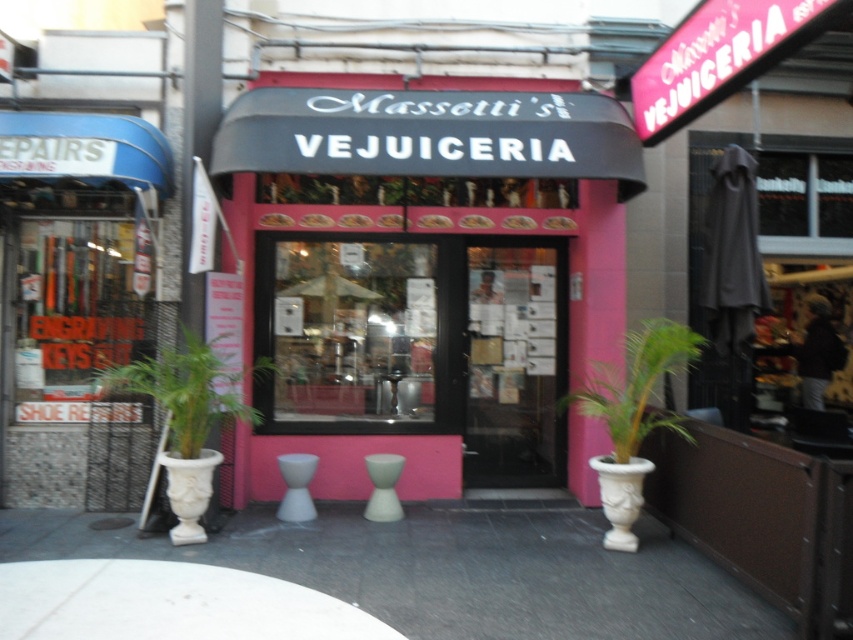
Between green leafy plant at lower right and white matte stool at center, which one has less height?

white matte stool at center is shorter.

Is green leafy plant at lower right positioned before white matte stool at center?

That is True.

Is point (566, 404) closer to camera compared to point (287, 456)?

No, (566, 404) is further to viewer.

Identify the location of green leafy plant at lower right. (637, 385).

Who is more forward, (x=254, y=417) or (x=372, y=502)?

Point (x=372, y=502) is in front.

Does green leafy plant at lower left have a greater width compared to white glossy stool at center?

Correct, the width of green leafy plant at lower left exceeds that of white glossy stool at center.

Is point (143, 378) positioned before point (397, 480)?

Yes, it is.

Locate an element on the screen. The width and height of the screenshot is (853, 640). green leafy plant at lower left is located at coordinates (184, 390).

Is point (647, 419) closer to viewer compared to point (387, 506)?

Yes, it is in front of point (387, 506).

This screenshot has height=640, width=853. I want to click on green leafy plant at lower right, so click(x=637, y=385).

Locate an element on the screen. Image resolution: width=853 pixels, height=640 pixels. green leafy plant at lower right is located at coordinates (637, 385).